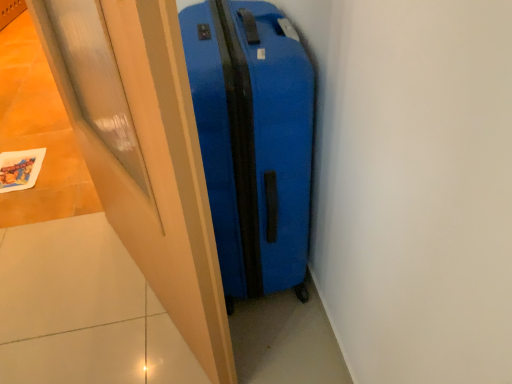
The height and width of the screenshot is (384, 512). Describe the element at coordinates (144, 153) in the screenshot. I see `matte wood door at center` at that location.

Measure the distance between matte wood door at center and camera.

matte wood door at center and camera are 18.16 inches apart.

Where is `matte wood door at center`? The image size is (512, 384). matte wood door at center is located at coordinates (144, 153).

At what (x,y) coordinates should I click in order to perform the action: click on blue matte suitcase at center. Please return your answer as a coordinate pair (x, y). The image size is (512, 384). Looking at the image, I should click on (253, 140).

Describe the element at coordinates (253, 140) in the screenshot. I see `blue matte suitcase at center` at that location.

Where is `matte wood door at center`? matte wood door at center is located at coordinates (144, 153).

In the image, is blue matte suitcase at center on the left side or the right side of matte wood door at center?

blue matte suitcase at center is to the right of matte wood door at center.

Based on the photo, which object is closer to the camera, blue matte suitcase at center or matte wood door at center?

Positioned in front is matte wood door at center.

Is point (184, 29) positioned before point (121, 95)?

Yes, point (184, 29) is closer to viewer.

From the image's perspective, is blue matte suitcase at center located beneath matte wood door at center?

No, from the image's perspective, blue matte suitcase at center is not below matte wood door at center.

From a real-world perspective, is blue matte suitcase at center physically below matte wood door at center?

Indeed, from a real-world perspective, blue matte suitcase at center is positioned beneath matte wood door at center.

In the scene shown: Between blue matte suitcase at center and matte wood door at center, which one has larger width?

blue matte suitcase at center.

Consider the image. Between blue matte suitcase at center and matte wood door at center, which one has more height?

With more height is matte wood door at center.

Is blue matte suitcase at center smaller than matte wood door at center?

No, blue matte suitcase at center is not smaller than matte wood door at center.

Is blue matte suitcase at center surrounding matte wood door at center?

No, matte wood door at center is not inside blue matte suitcase at center.

Is the surface of blue matte suitcase at center in direct contact with matte wood door at center?

No, blue matte suitcase at center is not next to matte wood door at center.

Could you tell me if blue matte suitcase at center is turned towards matte wood door at center?

Yes, blue matte suitcase at center is aimed at matte wood door at center.

Measure the distance between blue matte suitcase at center and matte wood door at center.

They are 10.71 inches apart.

You are a GUI agent. You are given a task and a screenshot of the screen. Output one action in this format:
    pyautogui.click(x=<x>, y=<y>)
    Task: Click on the door that appears on the left of blue matte suitcase at center
    The image size is (512, 384).
    Given the screenshot: What is the action you would take?
    pyautogui.click(x=144, y=153)

Does matte wood door at center appear on the left side of blue matte suitcase at center?

Yes.

Is matte wood door at center closer to camera compared to blue matte suitcase at center?

That is True.

Which is more distant, (78, 130) or (236, 131)?

The point (78, 130) is behind.

From the image's perspective, which is above, matte wood door at center or blue matte suitcase at center?

From the image's view, blue matte suitcase at center is above.

From a real-world perspective, which is physically below, matte wood door at center or blue matte suitcase at center?

From a 3D spatial view, blue matte suitcase at center is below.

Considering the sizes of objects matte wood door at center and blue matte suitcase at center in the image provided, who is wider, matte wood door at center or blue matte suitcase at center?

A: blue matte suitcase at center.

Does matte wood door at center have a greater height compared to blue matte suitcase at center?

Yes, matte wood door at center is taller than blue matte suitcase at center.

Considering the sizes of objects matte wood door at center and blue matte suitcase at center in the image provided, who is bigger, matte wood door at center or blue matte suitcase at center?

Bigger between the two is blue matte suitcase at center.

Would you say matte wood door at center is inside or outside blue matte suitcase at center?

matte wood door at center is outside blue matte suitcase at center.

Is matte wood door at center far from blue matte suitcase at center?

No, matte wood door at center is not far from blue matte suitcase at center.

Is matte wood door at center looking in the opposite direction of blue matte suitcase at center?

Yes, matte wood door at center's orientation is away from blue matte suitcase at center.

Can you tell me how much matte wood door at center and blue matte suitcase at center differ in facing direction?

The angle between the facing direction of matte wood door at center and the facing direction of blue matte suitcase at center is 23.8 degrees.

Find the location of `suitcase that appears below the matte wood door at center (from a real-world perspective)`. suitcase that appears below the matte wood door at center (from a real-world perspective) is located at coordinates (x=253, y=140).

You are a GUI agent. You are given a task and a screenshot of the screen. Output one action in this format:
    pyautogui.click(x=<x>, y=<y>)
    Task: Click on the door above the blue matte suitcase at center (from a real-world perspective)
    
    Given the screenshot: What is the action you would take?
    pyautogui.click(x=144, y=153)

At what (x,y) coordinates should I click in order to perform the action: click on suitcase below the matte wood door at center (from a real-world perspective). Please return your answer as a coordinate pair (x, y). Looking at the image, I should click on (253, 140).